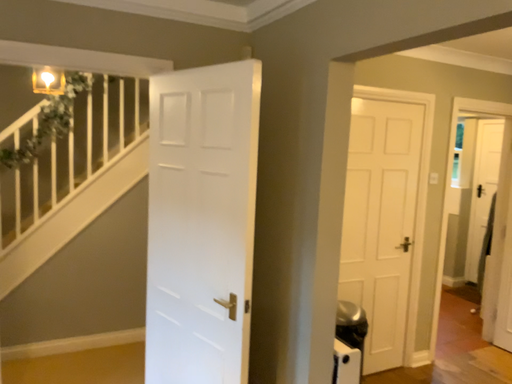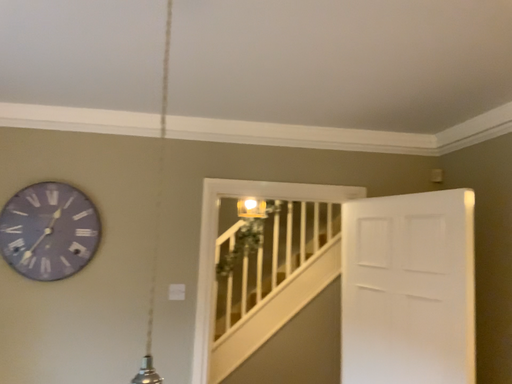
Question: How did the camera likely rotate when shooting the video?

Choices:
 (A) rotated upward
 (B) rotated downward

Answer: (A)